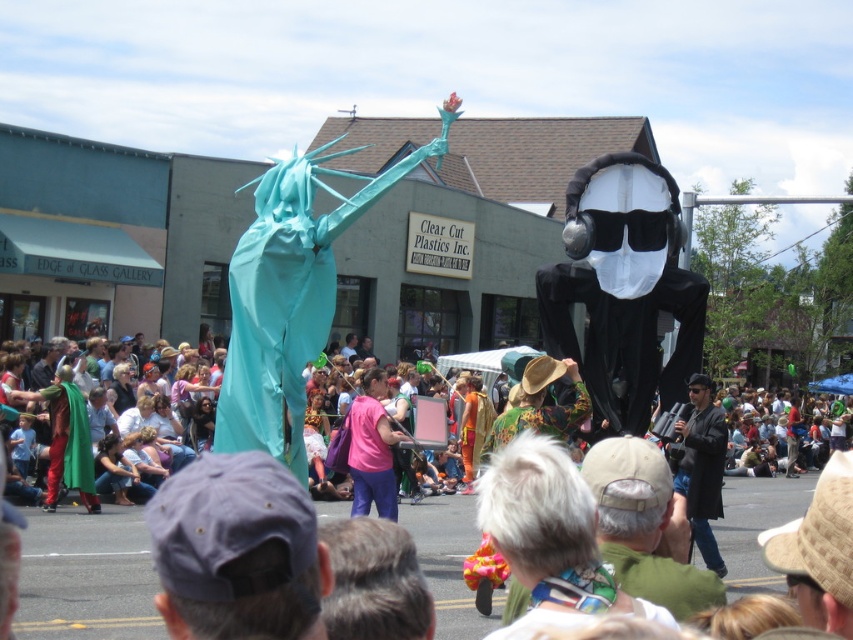
Based on the scene description, can you determine which object is larger between the black matte ghost at center and the teal fabric statue at center?

The teal fabric statue at center is larger than the black matte ghost at center.

You are a photographer positioned at the back of the crowd. You want to capture both the teal fabric statue at center and the pink fabric shirt at center in the same frame. Considering their positions, which object should you focus on first to ensure both are in the shot?

Since the teal fabric statue at center is wider than the pink fabric shirt at center, you should focus on the teal fabric statue at center first to ensure both fit within the frame.

You are a photographer positioned behind the crowd, aiming to capture both the teal fabric statue at center and the dark blue fabric cap at center in a single frame. Given their heights, which one will appear larger in your photo?

The teal fabric statue at center will appear larger in the photo because it is taller than the dark blue fabric cap at center.